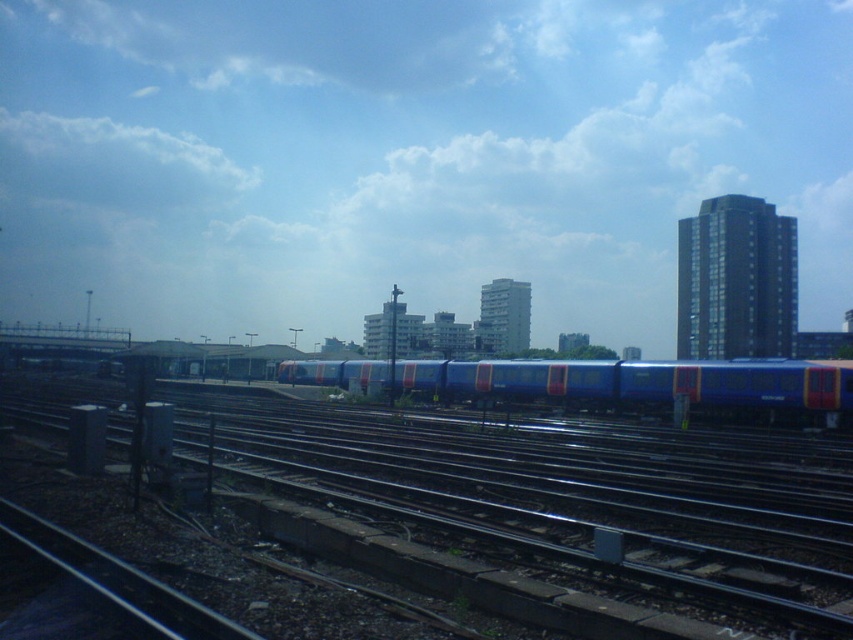
You are a railway worker standing on the metallic tracks at center. You need to reach the blue metallic train at center for maintenance. Which direction should you walk to get there?

The metallic tracks at center is positioned on the left side of the blue metallic train at center, so you should walk to the right to reach the blue metallic train at center.

You are standing at the origin point of the image. Which direction should you walk to reach the metallic tracks at center?

Walk towards the point at 0.780 on the x axis and 0.672 on the y axis to reach the metallic tracks at center.

Consider the image. You are a maintenance worker standing at the point labeled point (573, 381). You need to reach the point labeled point (502, 445) to inspect a track. Given that the distance between these two points is 10 meters, can you walk directly to the target point without crossing any active railway tracks?

Point (502, 445) is in front of point (573, 381). Since the path between them is 10 meters and there is no mention of active tracks in the scene description, you can walk directly to the target point.